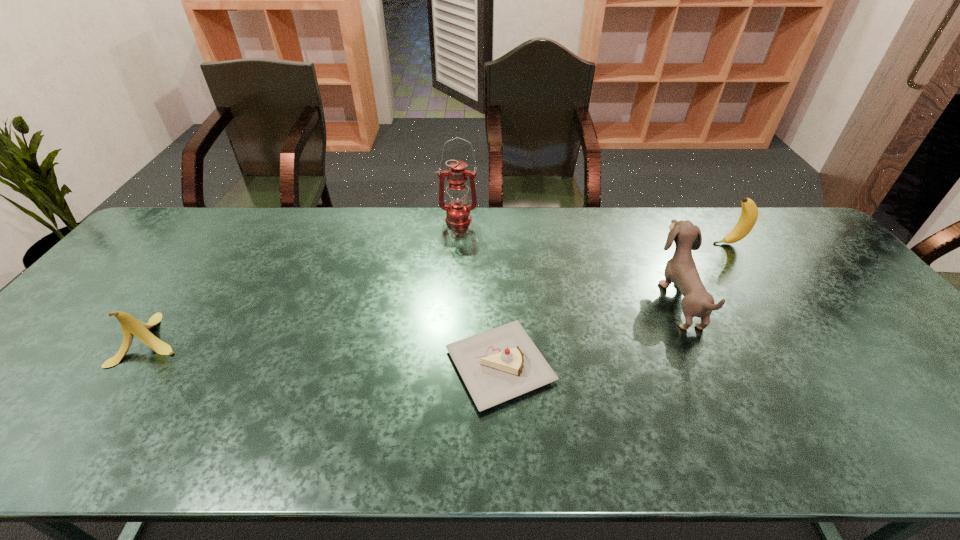
Image resolution: width=960 pixels, height=540 pixels. Identify the location of free spot between the puppy and the oil lamp. click(x=568, y=260).

Identify the location of free spot between the leftmost object and the cake. This screenshot has width=960, height=540. (326, 352).

I want to click on empty space between the shorter banana and the taller banana, so tap(441, 292).

Where is `vacant space that's between the shortest object and the farther banana`? vacant space that's between the shortest object and the farther banana is located at coordinates (614, 305).

Image resolution: width=960 pixels, height=540 pixels. In order to click on object that can be found as the closest to the puppy in this screenshot , I will do point(749,214).

Identify which object is the third closest to the farther banana. Please provide its 2D coordinates. Your answer should be formatted as a tuple, i.e. [(x, y)], where the tuple contains the x and y coordinates of a point satisfying the conditions above.

[(458, 213)]

This screenshot has width=960, height=540. Identify the location of vacant space that satisfies the following two spatial constraints: 1. on the back side of the oil lamp; 2. on the left side of the left banana. (238, 220).

At what (x,y) coordinates should I click in order to perform the action: click on vacant space that satisfies the following two spatial constraints: 1. on the front side of the cake; 2. on the right side of the left banana. Please return your answer as a coordinate pair (x, y). The image size is (960, 540). Looking at the image, I should click on (134, 366).